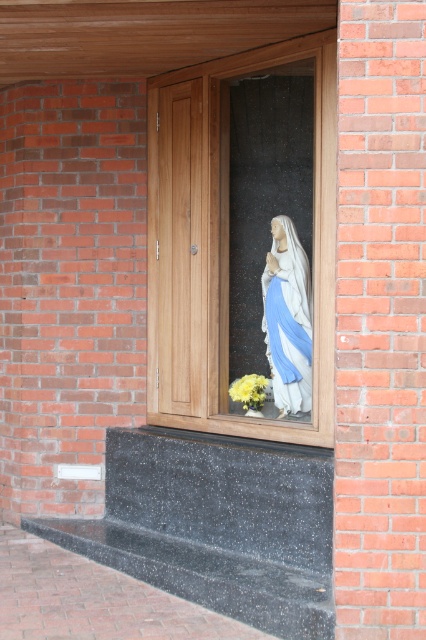
You are an interior designer trying to place a new shelf between the transparent glass statue at center and the white marble statue at center. The shelf requires 1 meter of space between the two statues to fit. Based on the scene, can the shelf be placed there?

The transparent glass statue at center is wider than the white marble statue at center, but the description does not provide specific measurements of the distance between them. Therefore, it is unclear if there is enough space for the shelf requiring 1 meter.

You are standing in front of the building and notice the transparent glass statue at center. Can you see through it to the window behind it?

Yes, because the transparent glass statue at center is made of transparent glass, you can see through it to the window behind it.